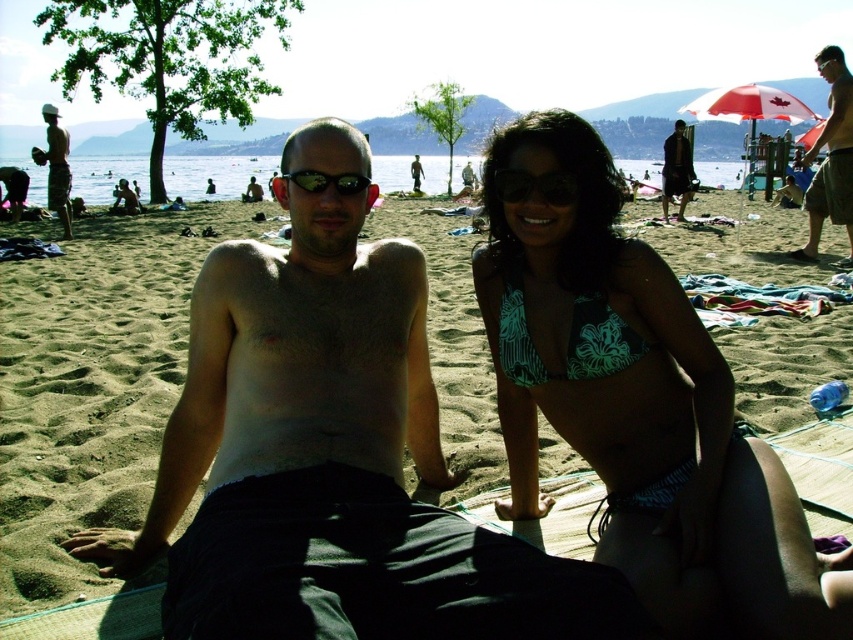
Based on the photo, can you confirm if khaki cotton shorts at center right is smaller than matte white hat at upper left?

Yes.

Measure the distance from khaki cotton shorts at center right to matte white hat at upper left.

khaki cotton shorts at center right and matte white hat at upper left are 10.63 meters apart.

This screenshot has width=853, height=640. I want to click on khaki cotton shorts at center right, so click(x=830, y=157).

Locate an element on the screen. The height and width of the screenshot is (640, 853). khaki cotton shorts at center right is located at coordinates pos(830,157).

Is teal floral bikini top at center above matte white hat at upper left?

Actually, teal floral bikini top at center is below matte white hat at upper left.

Between point (849, 636) and point (65, 237), which one is positioned in front?

Point (849, 636) is more forward.

The height and width of the screenshot is (640, 853). In order to click on teal floral bikini top at center in this screenshot , I will do `click(639, 406)`.

Can you confirm if teal floral bikini top at center is taller than black rubber goggles at center?

Indeed, teal floral bikini top at center has a greater height compared to black rubber goggles at center.

Who is lower down, teal floral bikini top at center or black rubber goggles at center?

teal floral bikini top at center

Between point (515, 257) and point (322, 184), which one is positioned behind?

The point (515, 257) is more distant.

Where is `teal floral bikini top at center`? This screenshot has height=640, width=853. teal floral bikini top at center is located at coordinates (639, 406).